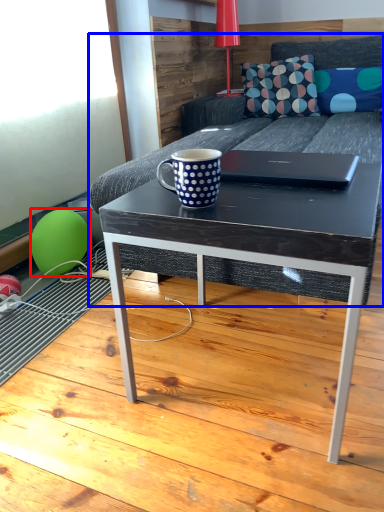
Question: Which object is further to the camera taking this photo, balloon (highlighted by a red box) or studio couch (highlighted by a blue box)?

Choices:
 (A) balloon
 (B) studio couch

Answer: (A)